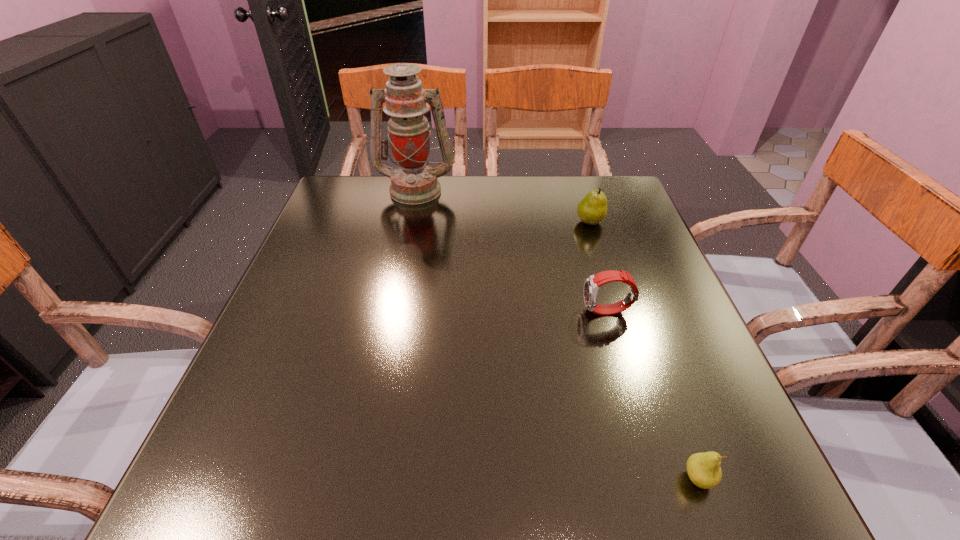
At what (x,y) coordinates should I click in order to perform the action: click on vacant space at the near edge of the desktop. Please return your answer as a coordinate pair (x, y). Image resolution: width=960 pixels, height=540 pixels. Looking at the image, I should click on (631, 458).

Locate an element on the screen. vacant space at the left edge of the desktop is located at coordinates coord(333,277).

Where is `vacant region at the right edge of the desktop`? vacant region at the right edge of the desktop is located at coordinates (631, 322).

This screenshot has width=960, height=540. I want to click on vacant position at the far left corner of the desktop, so click(330, 209).

Image resolution: width=960 pixels, height=540 pixels. Find the location of `free space at the near left corner of the desktop`. free space at the near left corner of the desktop is located at coordinates pyautogui.click(x=244, y=469).

At what (x,y) coordinates should I click in order to perform the action: click on blank space at the far right corner. Please return your answer as a coordinate pair (x, y). This screenshot has height=540, width=960. Looking at the image, I should click on (624, 184).

I want to click on vacant area between the nearest object and the farthest object, so click(x=557, y=334).

Locate an element on the screen. unoccupied position between the farther pear and the tallest object is located at coordinates (503, 206).

You are a GUI agent. You are given a task and a screenshot of the screen. Output one action in this format:
    pyautogui.click(x=<x>, y=<y>)
    Task: Click on the unoccupied area between the watch and the third nearest object
    The height and width of the screenshot is (540, 960).
    Given the screenshot: What is the action you would take?
    pyautogui.click(x=599, y=267)

Image resolution: width=960 pixels, height=540 pixels. Identify the location of unoccupied area between the watch and the nearer pear. (653, 395).